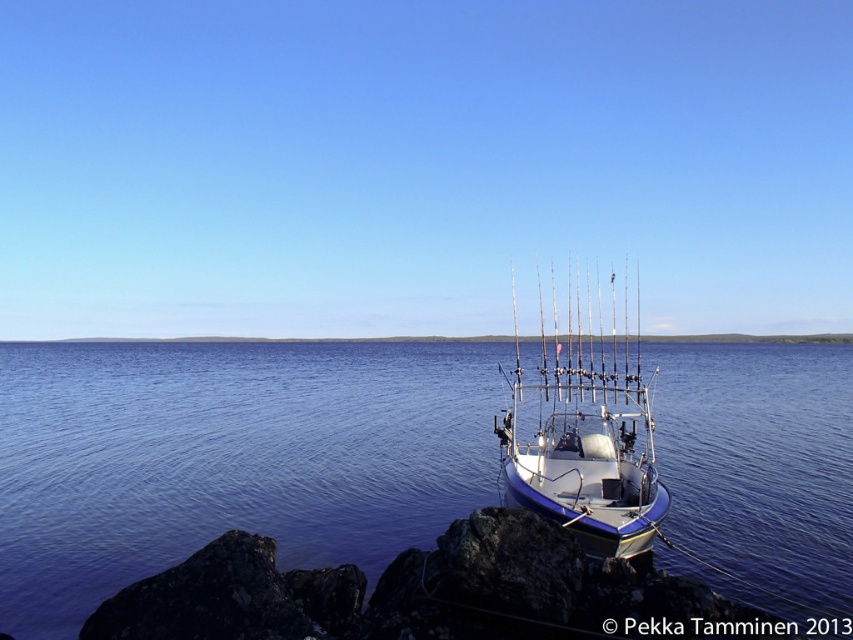
You are standing on the shore looking at the blue water at center and the white glossy boat at center. Which object is closer to you?

The blue water at center is closer to you because it is in front of the white glossy boat at center.

You are standing on the rocky shore looking at the blue water at center and the white glossy boat at center. Which object is closer to the horizon?

The white glossy boat at center is closer to the horizon than the blue water at center because the blue water at center is located below the boat.

You are standing on the dock and want to take a photo of the blue water at center. If your camera can focus on objects up to 30 feet away, will you need to move closer to capture a clear image?

The blue water at center is 33.81 feet away from the camera. Since the camera can focus up to 30 feet, you need to move closer to ensure the blue water at center is within the camera range.